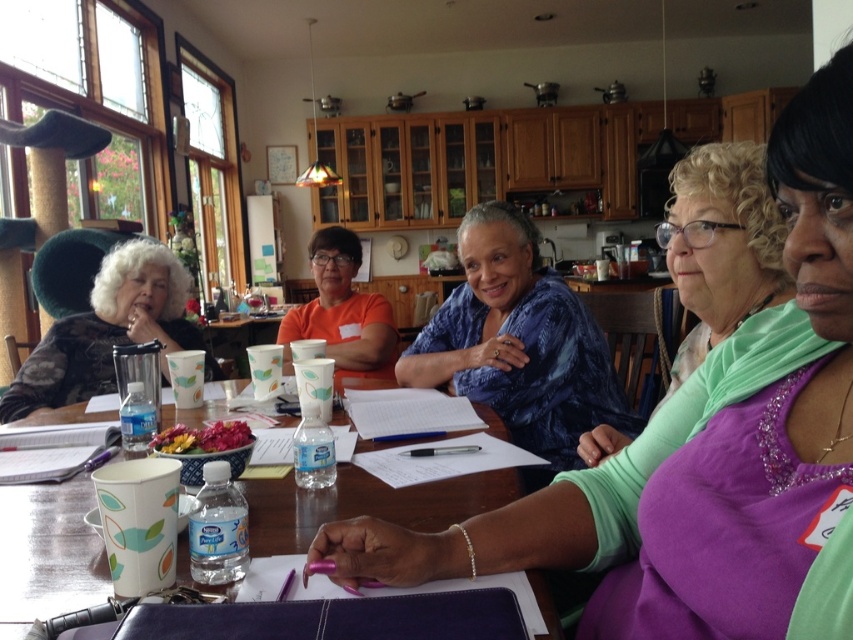
You are organizing a fashion show and need to arrange the purple satin blouse at center and the blue patterned blouse at center based on their lengths. Which blouse should be placed first if you want to arrange them from shortest to longest?

The purple satin blouse at center is shorter than the blue patterned blouse at center, so it should be placed first in the arrangement from shortest to longest.

You are organizing a clothing donation drive and need to pack shirts into boxes. The green matte shirt at center and orange fabric shirt at center are both on the table. Which shirt should you choose if you want to pack the thinnest one first?

The green matte shirt at center is thinner than the orange fabric shirt at center, so you should choose the green matte shirt at center first.

In the scene shown: You are standing in the room and want to reach the point at coordinates [700,467] on the table. If your arm is 70 centimeters long, can you comfortably reach it without moving your body?

The point at coordinates [700,467] is 72.90 centimeters away from you, which is slightly longer than your arm length of 70 centimeters. Therefore, you cannot comfortably reach it without moving your body.